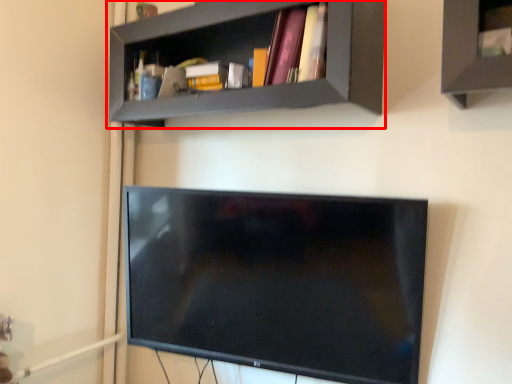
Question: From the image's perspective, considering the relative positions of shelf (annotated by the red box) and book in the image provided, where is shelf (annotated by the red box) located with respect to the staircase?

Choices:
 (A) below
 (B) above

Answer: (B)